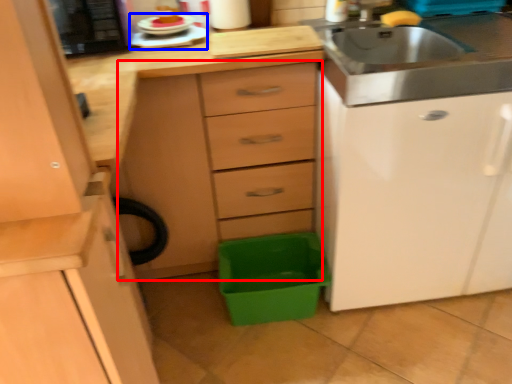
Question: Which of the following is the farthest to the observer, chest of drawers (highlighted by a red box) or appliance (highlighted by a blue box)?

Choices:
 (A) chest of drawers
 (B) appliance

Answer: (B)